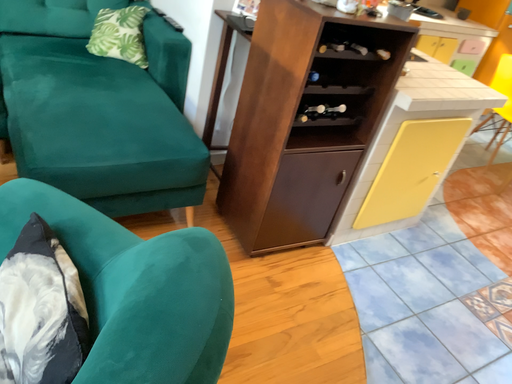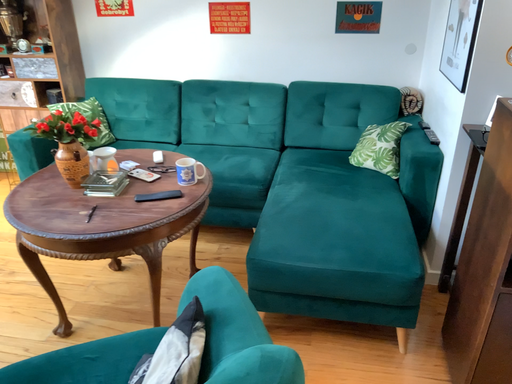
Question: How did the camera likely rotate when shooting the video?

Choices:
 (A) rotated left
 (B) rotated right

Answer: (A)